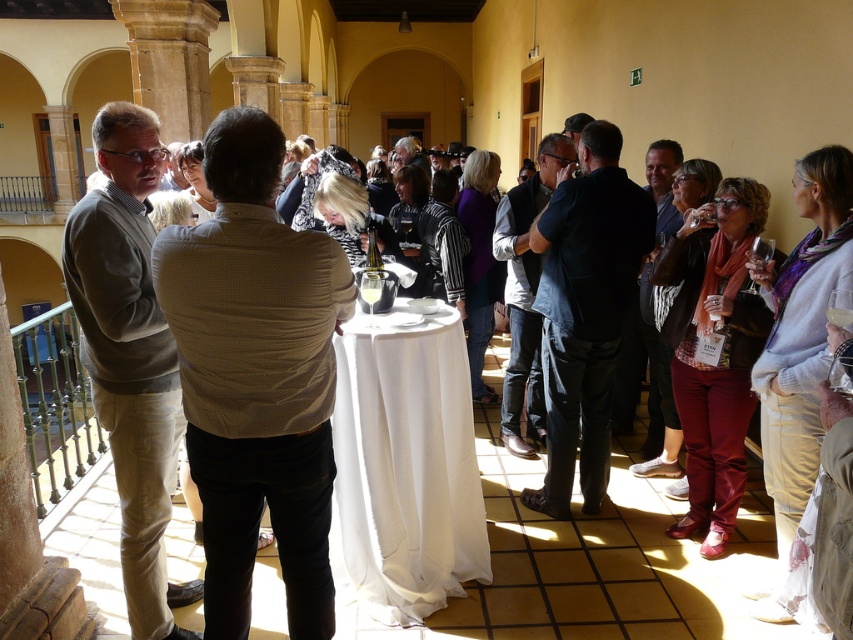
Where is `white cloth-covered table at center`? This screenshot has height=640, width=853. white cloth-covered table at center is located at coordinates (405, 464).

Does white cloth-covered table at center lie in front of dark blue shirt at center?

Yes, it is in front of dark blue shirt at center.

Does point (451, 390) come closer to viewer compared to point (610, 225)?

Yes.

You are a GUI agent. You are given a task and a screenshot of the screen. Output one action in this format:
    pyautogui.click(x=<x>, y=<y>)
    Task: Click on the white cloth-covered table at center
    The width and height of the screenshot is (853, 640).
    Given the screenshot: What is the action you would take?
    tap(405, 464)

Does white cloth-covered table at center lie behind light brown sweater at left?

That is True.

Is white cloth-covered table at center taller than light brown sweater at left?

No.

Identify the location of white cloth-covered table at center. The height and width of the screenshot is (640, 853). (405, 464).

This screenshot has height=640, width=853. I want to click on white cloth-covered table at center, so click(405, 464).

Is dark blue shirt at center thinner than dark blue jeans at center?

In fact, dark blue shirt at center might be wider than dark blue jeans at center.

Can you confirm if dark blue shirt at center is wider than dark blue jeans at center?

Yes.

Between point (611, 308) and point (544, 426), which one is positioned behind?

The point (544, 426) is behind.

Image resolution: width=853 pixels, height=640 pixels. I want to click on dark blue shirt at center, so click(585, 310).